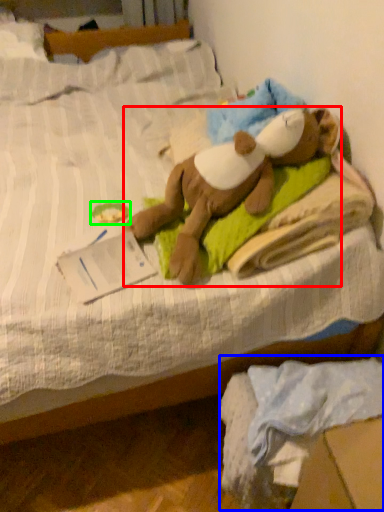
Question: Estimate the real-world distances between objects in this image. Which object is farther from person (highlighted by a red box), material (highlighted by a blue box) or toy (highlighted by a green box)?

Choices:
 (A) material
 (B) toy

Answer: (A)